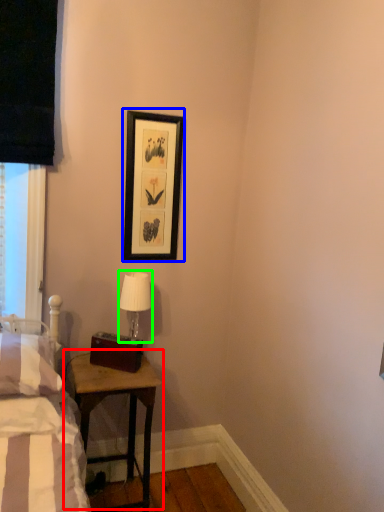
Question: Which is farther away from table (highlighted by a red box)? picture frame (highlighted by a blue box) or table lamp (highlighted by a green box)?

Choices:
 (A) picture frame
 (B) table lamp

Answer: (A)